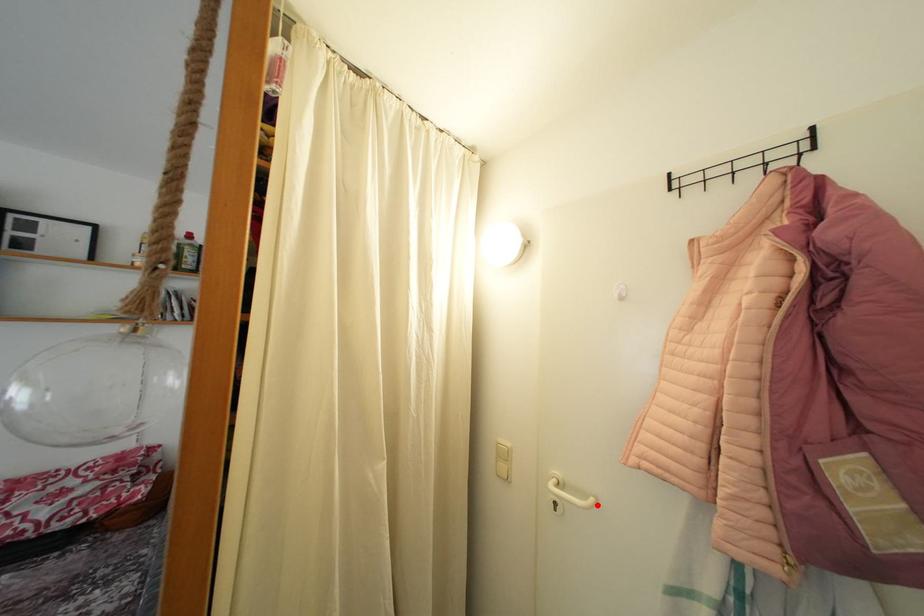
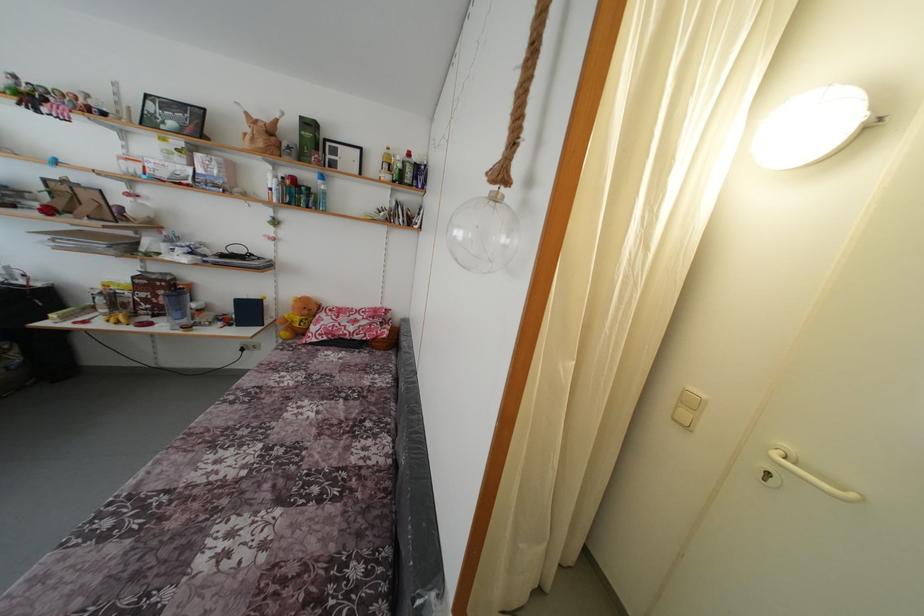
In the second image, find the point that corresponds to the highlighted location in the first image.

(859, 501)